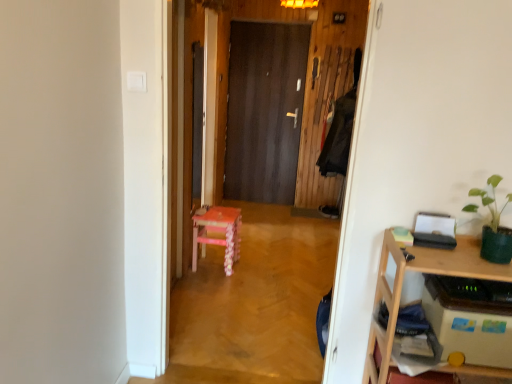
I want to click on free spot to the left of green matte plant at upper right, so click(418, 255).